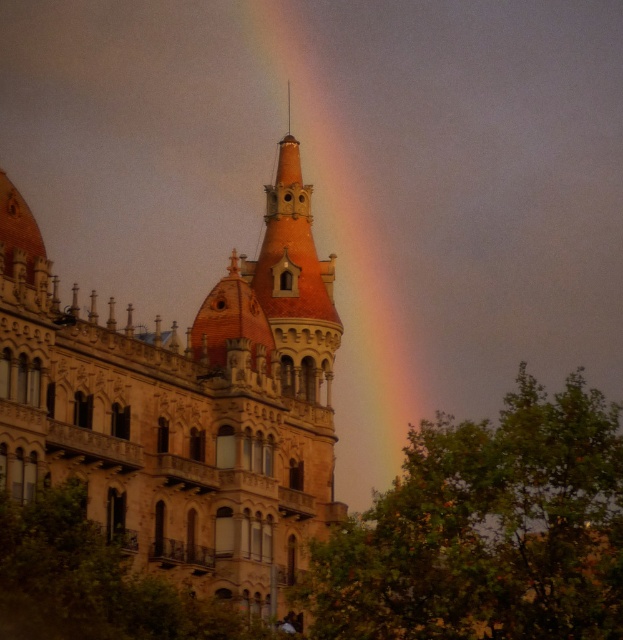
You are standing in front of the brown stone palace at center and the green leafy tree at lower right. Which object is positioned to the left when viewed from your perspective?

The brown stone palace at center is positioned to the left of the green leafy tree at lower right.

You are a painter standing at the base of the green leafy tree at lower right, looking towards the rainbow at upper center. Which object appears wider from your perspective?

The green leafy tree at lower right appears wider than the rainbow at upper center because its width is larger.

You are a landscape architect planning to install a walkway between the brown stone palace at center and the green leafy tree at lower right. The walkway requires a minimum clearance of 15 meters between the two points. Based on the scene, will the existing distance suffice for the walkway installation?

The distance between the brown stone palace at center and the green leafy tree at lower right is 15.76 meters, which exceeds the required 15 meters. Therefore, the existing distance is sufficient for the walkway installation.